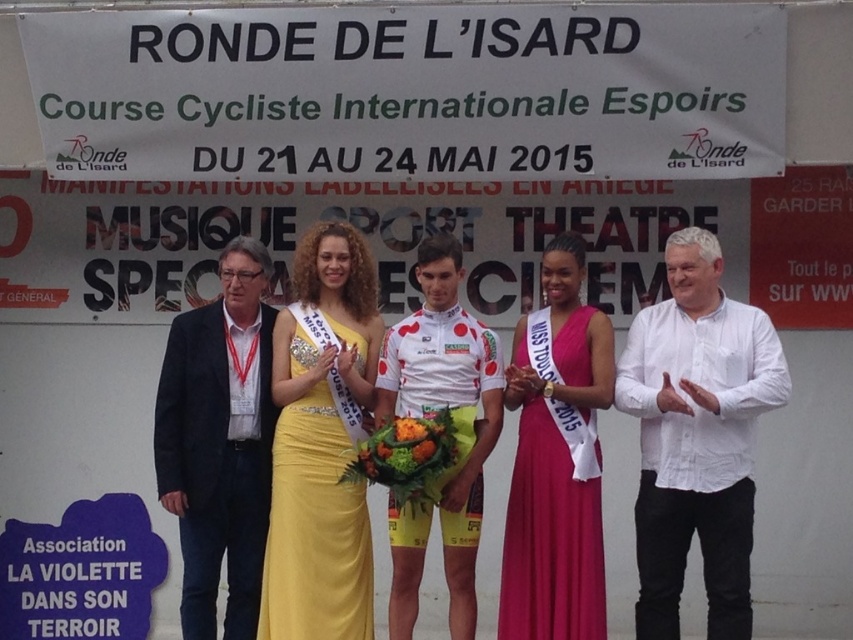
The image size is (853, 640). What do you see at coordinates (219, 442) in the screenshot?
I see `dark blue suit at left` at bounding box center [219, 442].

Can you confirm if dark blue suit at left is taller than yellow satin dress at center?

Indeed, dark blue suit at left has a greater height compared to yellow satin dress at center.

Where is `dark blue suit at left`? dark blue suit at left is located at coordinates (219, 442).

Between point (265, 387) and point (469, 333), which one is positioned behind?

The point (265, 387) is behind.

Between dark blue suit at left and white dotted jersey at center, which one appears on the right side from the viewer's perspective?

From the viewer's perspective, white dotted jersey at center appears more on the right side.

Where is `dark blue suit at left`? The height and width of the screenshot is (640, 853). dark blue suit at left is located at coordinates (219, 442).

The height and width of the screenshot is (640, 853). Find the location of `dark blue suit at left`. dark blue suit at left is located at coordinates (219, 442).

Can you confirm if white dotted jersey at center is smaller than yellow satin dress at center?

Incorrect, white dotted jersey at center is not smaller in size than yellow satin dress at center.

What do you see at coordinates (448, 404) in the screenshot? I see `white dotted jersey at center` at bounding box center [448, 404].

Which is behind, point (421, 356) or point (323, 560)?

Positioned behind is point (421, 356).

This screenshot has width=853, height=640. Find the location of `white dotted jersey at center`. white dotted jersey at center is located at coordinates (448, 404).